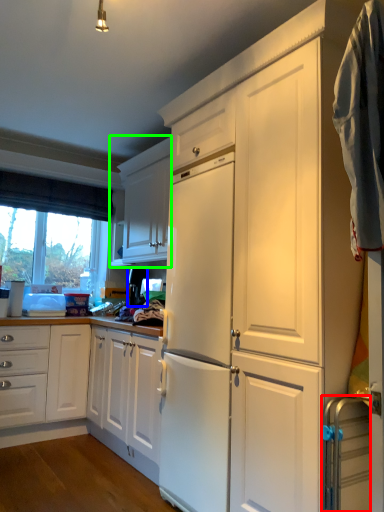
Question: Which is nearer to the appliance (highlighted by a red box)? appliance (highlighted by a blue box) or cabinetry (highlighted by a green box).

Choices:
 (A) appliance
 (B) cabinetry

Answer: (A)